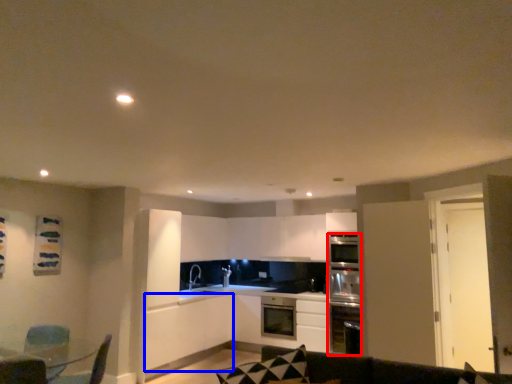
Question: Which of the following is the farthest to the observer, oven (highlighted by a red box) or cabinetry (highlighted by a blue box)?

Choices:
 (A) oven
 (B) cabinetry

Answer: (A)